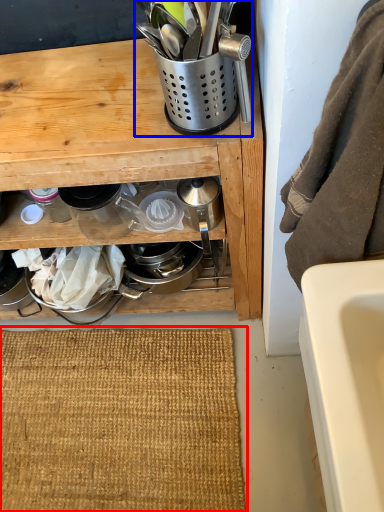
Question: Which object is further to the camera taking this photo, doormat (highlighted by a red box) or appliance (highlighted by a blue box)?

Choices:
 (A) doormat
 (B) appliance

Answer: (A)